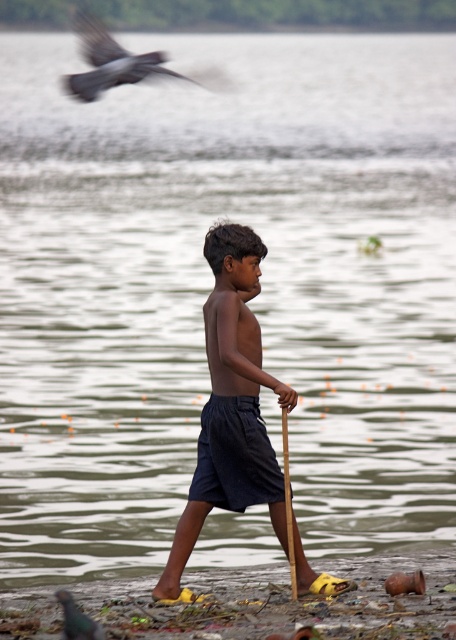
Question: Which object is farther from the camera taking this photo?

Choices:
 (A) green glossy bird at lower left
 (B) yellow rubber sandals at lower center
 (C) dark gray feathers at upper left

Answer: (C)

Question: Is the position of dark blue shorts at center less distant than that of dark gray feathers at upper left?

Choices:
 (A) no
 (B) yes

Answer: (B)

Question: Which point appears farthest from the camera in this image?

Choices:
 (A) tap(120, 52)
 (B) tap(72, 604)
 (C) tap(179, 593)

Answer: (A)

Question: Does yellow rubber sandals at lower center lie behind green glossy bird at lower left?

Choices:
 (A) yes
 (B) no

Answer: (A)

Question: Can you confirm if yellow rubber sandals at lower center is positioned below dark blue shorts at center?

Choices:
 (A) no
 (B) yes

Answer: (B)

Question: Which object appears closest to the camera in this image?

Choices:
 (A) green glossy bird at lower left
 (B) dark gray feathers at upper left
 (C) yellow rubber sandals at lower center
 (D) dark blue shorts at center

Answer: (A)